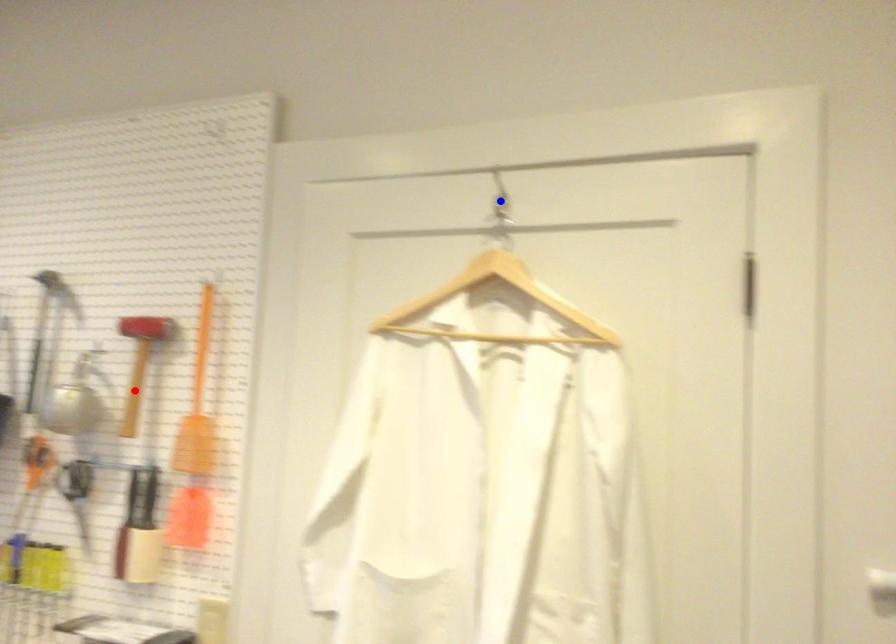
Question: In the image, two points are highlighted. Which point is nearer to the camera? Reply with the corresponding letter.

Choices:
 (A) blue point
 (B) red point

Answer: (A)